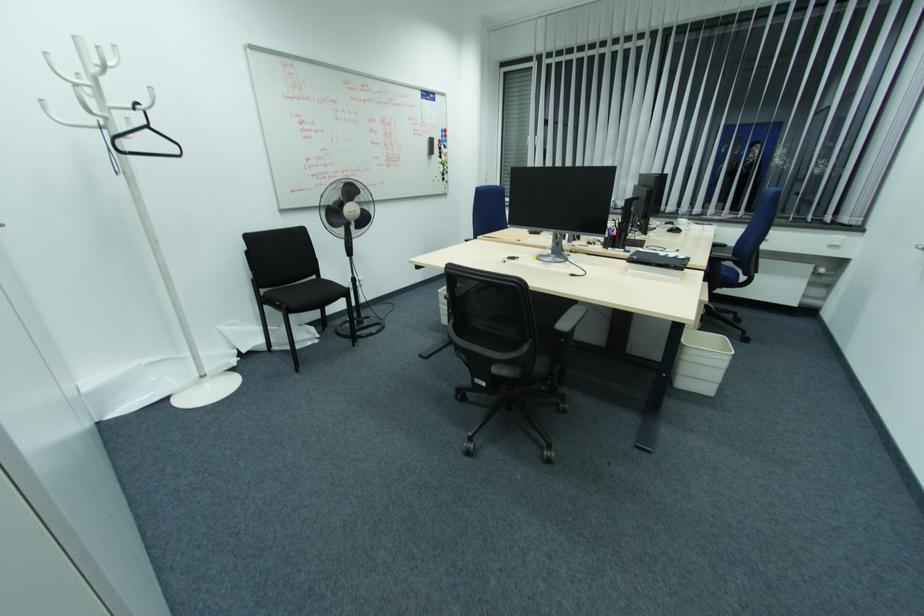
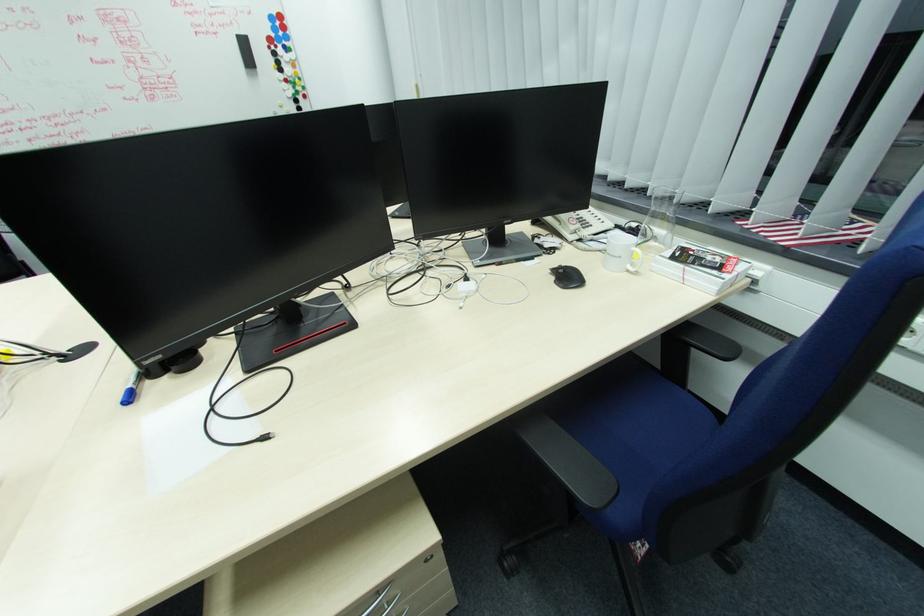
Which direction would the cameraman need to move to produce the second image?

The cameraman moved toward right, forward.